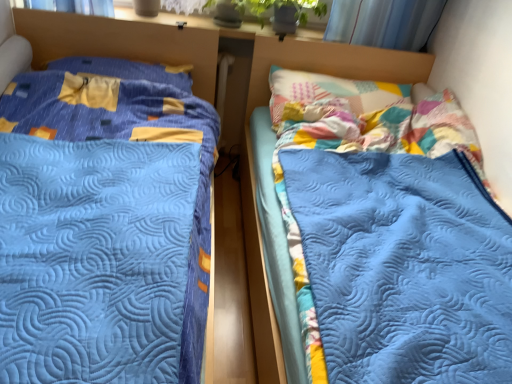
Question: Does blue quilted bed at center, the 2th bed from the left, appear on the right side of blue quilted bed at left, placed as the first bed when sorted from left to right?

Choices:
 (A) no
 (B) yes

Answer: (B)

Question: Does blue quilted bed at center, placed as the first bed when sorted from right to left, have a smaller size compared to blue quilted bed at left, placed as the 2th bed when sorted from right to left?

Choices:
 (A) yes
 (B) no

Answer: (A)

Question: From the image's perspective, does blue quilted bed at center, the 2th bed from the left, appear lower than blue quilted bed at left, placed as the first bed when sorted from left to right?

Choices:
 (A) yes
 (B) no

Answer: (A)

Question: Can you confirm if blue quilted bed at center, the 2th bed from the left, is taller than blue quilted bed at left, placed as the 2th bed when sorted from right to left?

Choices:
 (A) no
 (B) yes

Answer: (A)

Question: From a real-world perspective, is blue quilted bed at center, placed as the first bed when sorted from right to left, beneath blue quilted bed at left, placed as the first bed when sorted from left to right?

Choices:
 (A) yes
 (B) no

Answer: (A)

Question: Is blue quilted bed at center, placed as the first bed when sorted from right to left, aimed at blue quilted bed at left, placed as the first bed when sorted from left to right?

Choices:
 (A) no
 (B) yes

Answer: (A)

Question: Is blue quilted bed at left, placed as the first bed when sorted from left to right, positioned far away from blue quilted bed at center, placed as the first bed when sorted from right to left?

Choices:
 (A) yes
 (B) no

Answer: (A)

Question: Is blue quilted bed at left, placed as the first bed when sorted from left to right, at the left side of blue quilted bed at center, placed as the first bed when sorted from right to left?

Choices:
 (A) yes
 (B) no

Answer: (A)

Question: Does blue quilted bed at left, placed as the 2th bed when sorted from right to left, have a larger size compared to blue quilted bed at center, placed as the first bed when sorted from right to left?

Choices:
 (A) yes
 (B) no

Answer: (A)

Question: From the image's perspective, is blue quilted bed at left, placed as the first bed when sorted from left to right, located beneath blue quilted bed at center, the 2th bed from the left?

Choices:
 (A) yes
 (B) no

Answer: (B)

Question: Is the surface of blue quilted bed at left, placed as the 2th bed when sorted from right to left, in direct contact with blue quilted bed at center, the 2th bed from the left?

Choices:
 (A) yes
 (B) no

Answer: (B)

Question: Considering the relative sizes of blue quilted bed at left, placed as the 2th bed when sorted from right to left, and blue quilted bed at center, the 2th bed from the left, in the image provided, is blue quilted bed at left, placed as the 2th bed when sorted from right to left, smaller than blue quilted bed at center, the 2th bed from the left,?

Choices:
 (A) no
 (B) yes

Answer: (A)

Question: From a real-world perspective, is yellow fabric pillow at upper left beneath blue quilted bed at left, placed as the first bed when sorted from left to right?

Choices:
 (A) no
 (B) yes

Answer: (A)